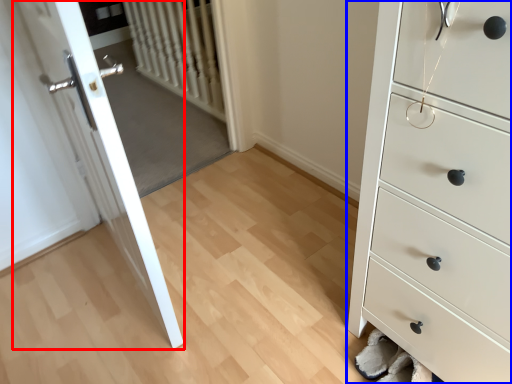
Question: Among these objects, which one is nearest to the camera, door (highlighted by a red box) or chest of drawers (highlighted by a blue box)?

Choices:
 (A) door
 (B) chest of drawers

Answer: (B)